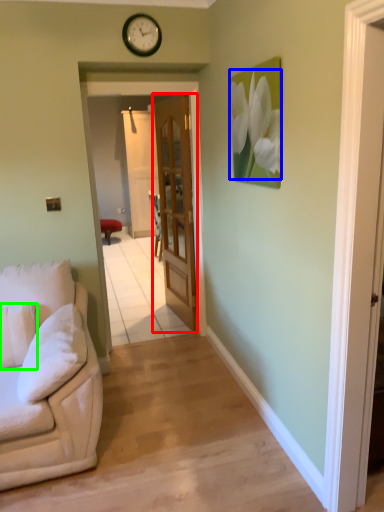
Question: Which is farther away from door (highlighted by a red box)? flower (highlighted by a blue box) or pillow (highlighted by a green box)?

Choices:
 (A) flower
 (B) pillow

Answer: (B)